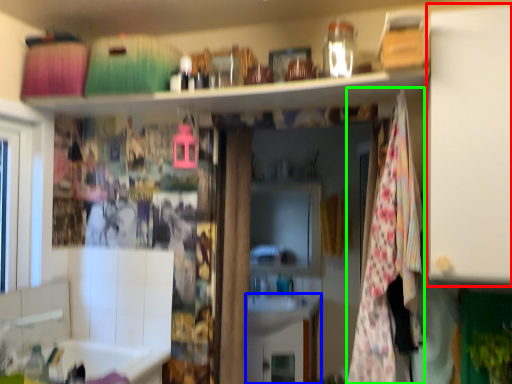
Question: Which is farther away from cabinet (highlighted by a red box)? cabinetry (highlighted by a blue box) or blanket (highlighted by a green box)?

Choices:
 (A) cabinetry
 (B) blanket

Answer: (A)